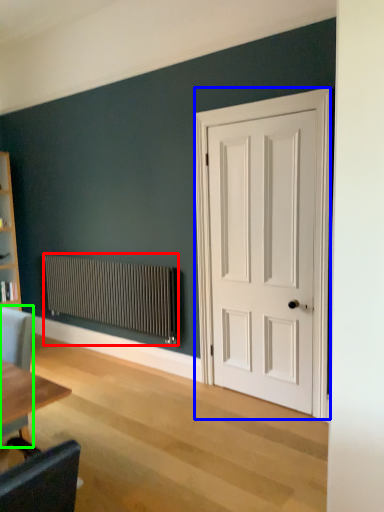
Question: Estimate the real-world distances between objects in this image. Which object is closer to radiator (highlighted by a red box), door (highlighted by a blue box) or chair (highlighted by a green box)?

Choices:
 (A) door
 (B) chair

Answer: (A)